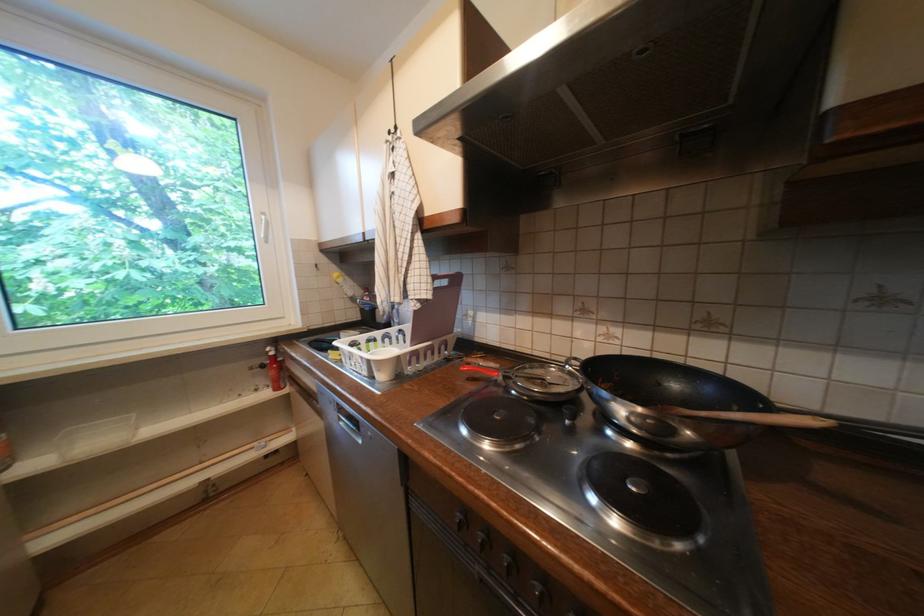
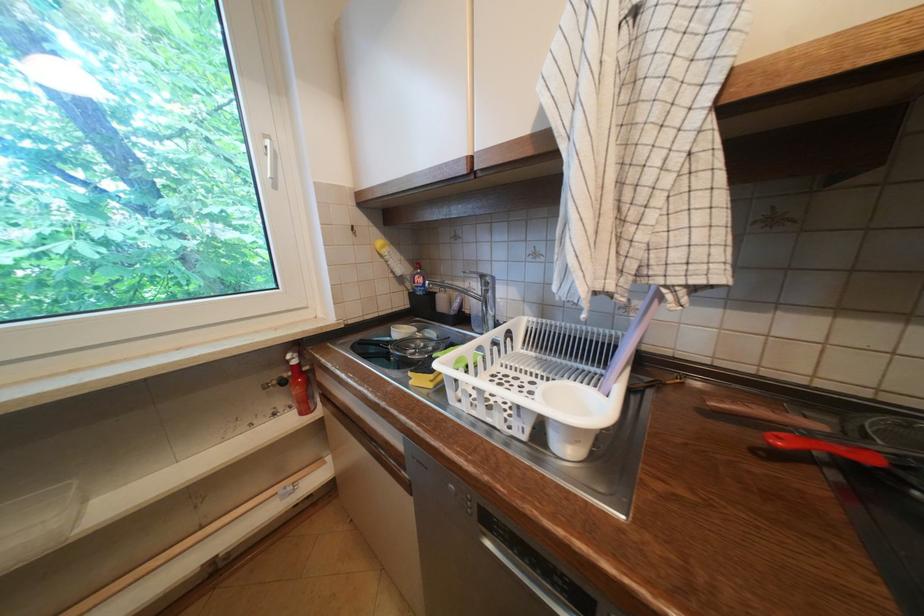
Find the pixel in the second image that matches the point at 275,354 in the first image.

(296, 362)